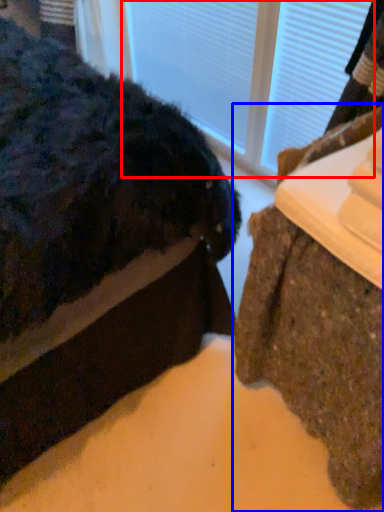
Question: Among these objects, which one is farthest to the camera, glass door (highlighted by a red box) or furniture (highlighted by a blue box)?

Choices:
 (A) glass door
 (B) furniture

Answer: (A)